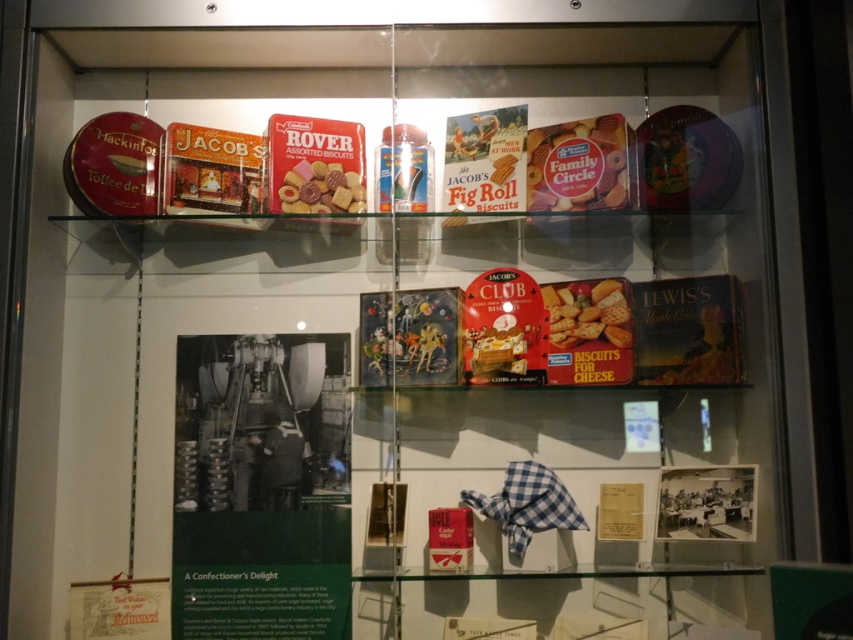
Question: Considering the relative positions of matte red box at upper center and matte cardboard biscuit at center in the image provided, where is matte red box at upper center located with respect to matte cardboard biscuit at center?

Choices:
 (A) above
 (B) below

Answer: (A)

Question: Which of the following is the closest to the observer?

Choices:
 (A) matte plastic assorted biscuits at upper center
 (B) matte cardboard biscuit at center

Answer: (B)

Question: Which object is closer to the camera taking this photo?

Choices:
 (A) matte plastic assorted biscuits at upper center
 (B) matte red box at upper center
 (C) matte cardboard biscuit at center

Answer: (C)

Question: Which object is the farthest from the matte cardboard biscuit at center?

Choices:
 (A) matte plastic assorted biscuits at upper center
 (B) matte red box at upper center

Answer: (A)

Question: Is matte red box at upper center below matte plastic assorted biscuits at upper center?

Choices:
 (A) yes
 (B) no

Answer: (B)

Question: Does matte cardboard biscuit at center have a greater width compared to matte plastic assorted biscuits at upper center?

Choices:
 (A) yes
 (B) no

Answer: (B)